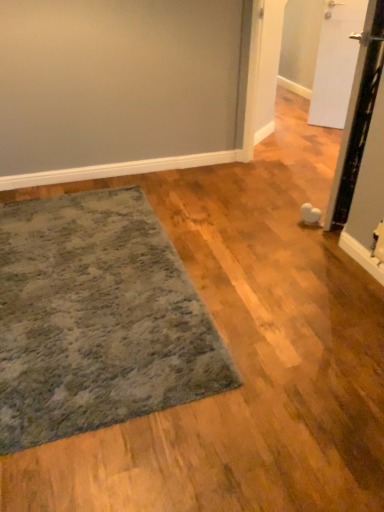
Question: Considering the relative positions of white matte door at upper right, placed as the 2th door when sorted from front to back, and textured gray rug at lower left in the image provided, is white matte door at upper right, placed as the 2th door when sorted from front to back, to the left of textured gray rug at lower left from the viewer's perspective?

Choices:
 (A) no
 (B) yes

Answer: (A)

Question: Is white matte door at upper right, placed as the 2th door when sorted from front to back, bigger than textured gray rug at lower left?

Choices:
 (A) no
 (B) yes

Answer: (A)

Question: Is white matte door at upper right, acting as the first door starting from the back, turned away from textured gray rug at lower left?

Choices:
 (A) no
 (B) yes

Answer: (A)

Question: Can you confirm if white matte door at upper right, acting as the first door starting from the back, is taller than textured gray rug at lower left?

Choices:
 (A) no
 (B) yes

Answer: (B)

Question: Is white matte door at upper right, acting as the first door starting from the back, thinner than textured gray rug at lower left?

Choices:
 (A) yes
 (B) no

Answer: (A)

Question: Looking at their shapes, would you say white matte door at upper right, placed as the 2th door when sorted from front to back, is wider or thinner than textured gray rug at lower left?

Choices:
 (A) wide
 (B) thin

Answer: (B)

Question: Considering the positions of white matte door at upper right, acting as the first door starting from the back, and textured gray rug at lower left in the image, is white matte door at upper right, acting as the first door starting from the back, taller or shorter than textured gray rug at lower left?

Choices:
 (A) tall
 (B) short

Answer: (A)

Question: From the image's perspective, is white matte door at upper right, placed as the 2th door when sorted from front to back, positioned above or below textured gray rug at lower left?

Choices:
 (A) above
 (B) below

Answer: (A)

Question: In terms of size, does white matte door at upper right, placed as the 2th door when sorted from front to back, appear bigger or smaller than textured gray rug at lower left?

Choices:
 (A) small
 (B) big

Answer: (A)

Question: From a real-world perspective, relative to white matte door at upper right, placed as the 2th door when sorted from front to back, is white glossy door at right, acting as the first door starting from the front, vertically above or below?

Choices:
 (A) above
 (B) below

Answer: (A)

Question: In terms of width, does white glossy door at right, acting as the first door starting from the front, look wider or thinner when compared to white matte door at upper right, placed as the 2th door when sorted from front to back?

Choices:
 (A) wide
 (B) thin

Answer: (A)

Question: Is point (375, 2) closer or farther from the camera than point (360, 18)?

Choices:
 (A) closer
 (B) farther

Answer: (A)

Question: From the image's perspective, is white glossy door at right, the second door from the back, located above or below white matte door at upper right, placed as the 2th door when sorted from front to back?

Choices:
 (A) above
 (B) below

Answer: (B)

Question: Considering the positions of white matte door at upper right, acting as the first door starting from the back, and white glossy door at right, acting as the first door starting from the front, in the image, is white matte door at upper right, acting as the first door starting from the back, bigger or smaller than white glossy door at right, acting as the first door starting from the front,?

Choices:
 (A) big
 (B) small

Answer: (B)

Question: Is white matte door at upper right, placed as the 2th door when sorted from front to back, wider or thinner than white glossy door at right, acting as the first door starting from the front?

Choices:
 (A) thin
 (B) wide

Answer: (A)